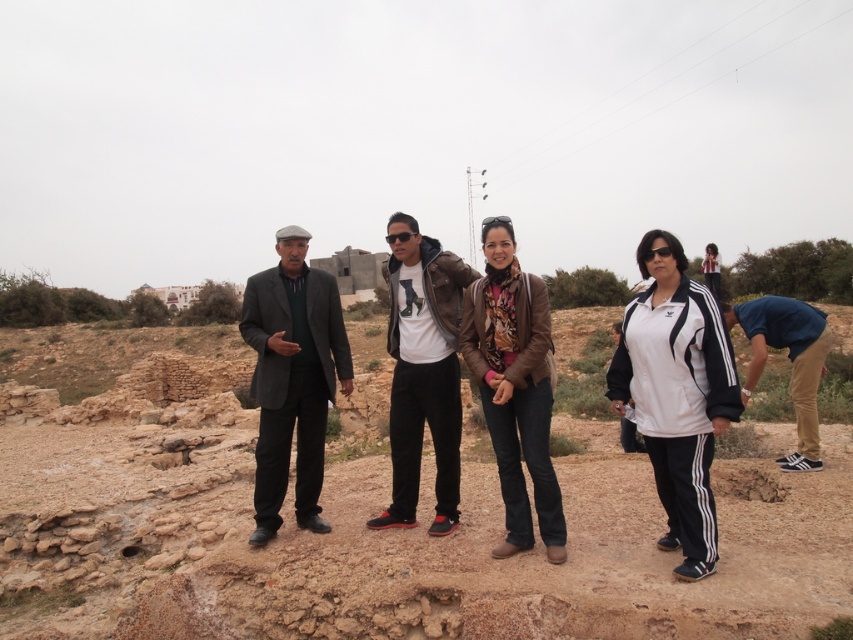
Who is more distant from viewer, (397,564) or (273,488)?

Point (273,488)

Does brown dirt field at center appear over dark gray woolen suit at center?

Incorrect, brown dirt field at center is not positioned above dark gray woolen suit at center.

The height and width of the screenshot is (640, 853). Identify the location of brown dirt field at center. (399, 540).

Does brown leather jacket at center appear on the left side of matte leather jacket at center?

Incorrect, brown leather jacket at center is not on the left side of matte leather jacket at center.

Looking at this image, does brown leather jacket at center have a greater width compared to matte leather jacket at center?

Incorrect, brown leather jacket at center's width does not surpass matte leather jacket at center's.

The height and width of the screenshot is (640, 853). What do you see at coordinates (514, 387) in the screenshot?
I see `brown leather jacket at center` at bounding box center [514, 387].

You are a GUI agent. You are given a task and a screenshot of the screen. Output one action in this format:
    pyautogui.click(x=<x>, y=<y>)
    Task: Click on the brown leather jacket at center
    Image resolution: width=853 pixels, height=640 pixels.
    Given the screenshot: What is the action you would take?
    pyautogui.click(x=514, y=387)

Does point (264, 291) come farther from viewer compared to point (817, 371)?

No, (264, 291) is in front of (817, 371).

Does dark gray woolen suit at center appear under blue fabric shirt at lower right?

Indeed, dark gray woolen suit at center is positioned under blue fabric shirt at lower right.

Is point (303, 419) in front of point (801, 406)?

Yes, it is in front of point (801, 406).

At what (x,y) coordinates should I click in order to perform the action: click on dark gray woolen suit at center. Please return your answer as a coordinate pair (x, y). Image resolution: width=853 pixels, height=640 pixels. Looking at the image, I should click on (292, 378).